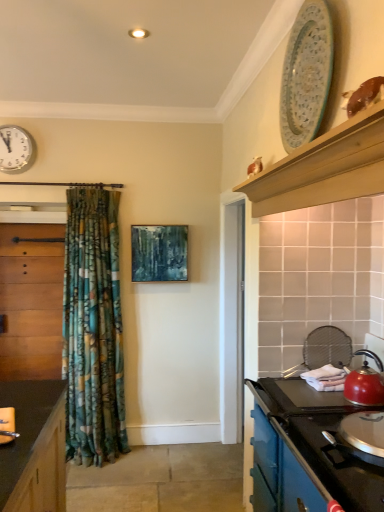
Question: Visually, is white glossy clock at upper left positioned to the left or to the right of teal matte painting at center?

Choices:
 (A) right
 (B) left

Answer: (B)

Question: Considering the positions of white glossy clock at upper left and teal matte painting at center in the image, is white glossy clock at upper left wider or thinner than teal matte painting at center?

Choices:
 (A) thin
 (B) wide

Answer: (A)

Question: Which object is the farthest from the porcelain plate at upper right?

Choices:
 (A) white glossy clock at upper left
 (B) wooden cabinet at left, acting as the 2th cabinetry starting from the front
 (C) matte black sink at lower left
 (D) blue enamel stove at lower right, the 2th cabinetry when ordered from left to right
 (E) matte red kettle at right

Answer: (B)

Question: Estimate the real-world distances between objects in this image. Which object is closer to the blue enamel stove at lower right, the 2th cabinetry when ordered from left to right?

Choices:
 (A) matte red kettle at right
 (B) teal matte painting at center
 (C) wooden cabinet at left, which is the first cabinetry in left-to-right order
 (D) porcelain plate at upper right
 (E) wooden plate at upper right

Answer: (A)